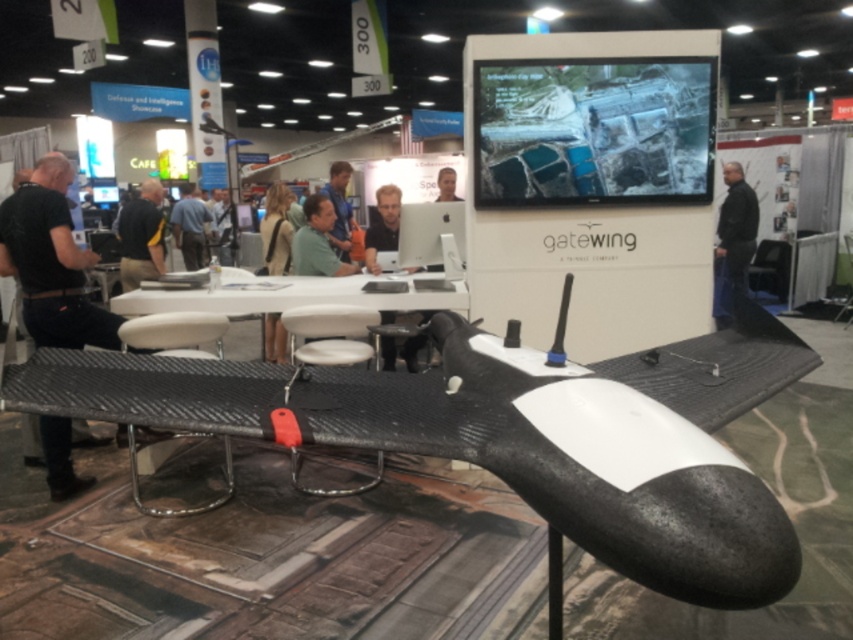
Question: Which of these objects is positioned closest to the black leather jacket at left?

Choices:
 (A) light brown leather jacket at center
 (B) black fabric shirt at center

Answer: (A)

Question: Considering the relative positions of black fabric shirt at left and matte black laptop at center in the image provided, where is black fabric shirt at left located with respect to matte black laptop at center?

Choices:
 (A) left
 (B) right

Answer: (A)

Question: Is green matte shirt at center in front of black fabric shirt at center?

Choices:
 (A) no
 (B) yes

Answer: (B)

Question: Can you confirm if black leather jacket at right is bigger than green matte shirt at center?

Choices:
 (A) yes
 (B) no

Answer: (B)

Question: Considering the real-world distances, which object is closest to the blue shirt at center?

Choices:
 (A) green matte shirt at center
 (B) carbon fiber plane at center

Answer: (A)

Question: Estimate the real-world distances between objects in this image. Which object is farther from the smooth skin face at center?

Choices:
 (A) black fabric shirt at left
 (B) matte black laptop at center
 (C) green matte shirt at center

Answer: (A)